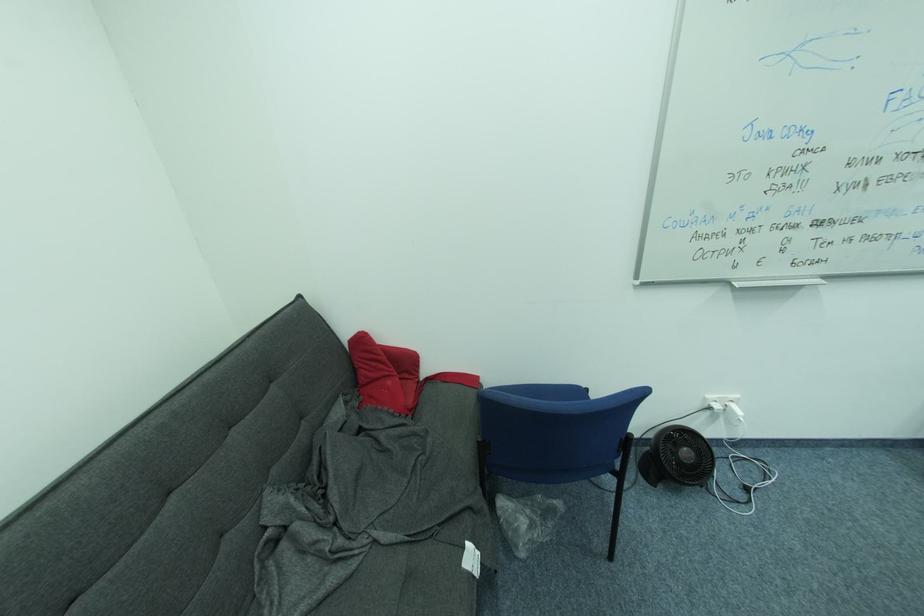
The width and height of the screenshot is (924, 616). In order to click on red cushion in this screenshot , I will do `click(383, 374)`.